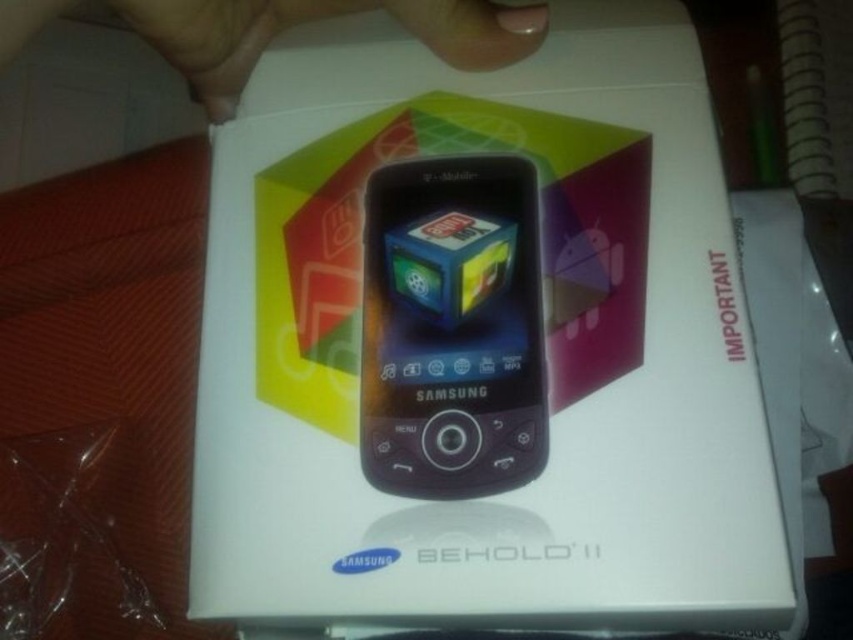
Can you confirm if white matte box at center is taller than purple glossy smartphone at center?

Yes, white matte box at center is taller than purple glossy smartphone at center.

Is white matte box at center in front of purple glossy smartphone at center?

That is True.

Is point (704, 285) farther from camera compared to point (376, 448)?

Yes, point (704, 285) is behind point (376, 448).

Locate an element on the screen. This screenshot has width=853, height=640. white matte box at center is located at coordinates (480, 342).

Does purple glossy smartphone at center have a greater height compared to nail polish at upper center?

Correct, purple glossy smartphone at center is much taller as nail polish at upper center.

Describe the element at coordinates (451, 328) in the screenshot. The width and height of the screenshot is (853, 640). I see `purple glossy smartphone at center` at that location.

Identify the location of purple glossy smartphone at center. The width and height of the screenshot is (853, 640). (451, 328).

Who is more distant from viewer, (368, 608) or (303, 0)?

Positioned behind is point (303, 0).

Consider the image. Who is lower down, white matte box at center or nail polish at upper center?

white matte box at center

Between point (567, 17) and point (492, 4), which one is positioned in front?

Point (492, 4) is more forward.

Locate an element on the screen. white matte box at center is located at coordinates (480, 342).